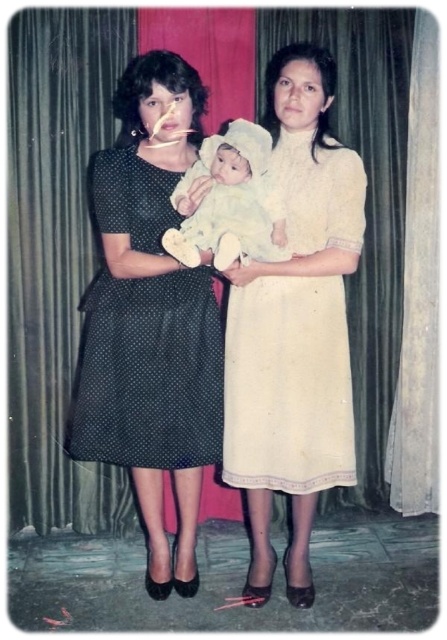
Question: Which object is farther from the camera taking this photo?

Choices:
 (A) creamy soft fabric dress at center
 (B) white soft baby at center

Answer: (A)

Question: Which of the following is the farthest from the observer?

Choices:
 (A) creamy soft fabric dress at center
 (B) black dotted dress at center

Answer: (B)

Question: Is creamy soft fabric dress at center wider than black dotted dress at center?

Choices:
 (A) no
 (B) yes

Answer: (A)

Question: Estimate the real-world distances between objects in this image. Which object is closer to the creamy soft fabric dress at center?

Choices:
 (A) black dotted dress at center
 (B) white soft baby at center

Answer: (B)

Question: Considering the relative positions of creamy soft fabric dress at center and white soft baby at center in the image provided, where is creamy soft fabric dress at center located with respect to white soft baby at center?

Choices:
 (A) above
 (B) below

Answer: (B)

Question: Can you confirm if black dotted dress at center is positioned below white soft baby at center?

Choices:
 (A) no
 (B) yes

Answer: (B)